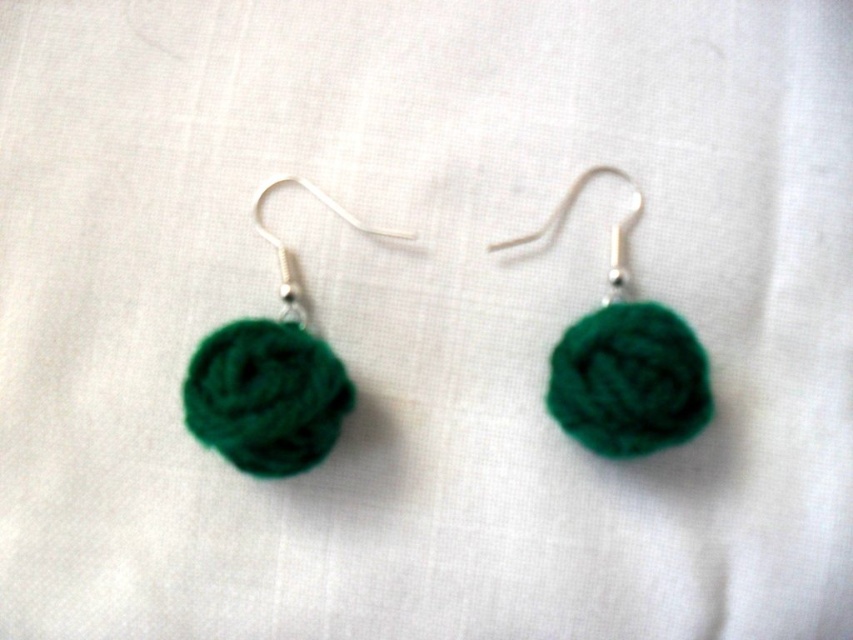
Question: Is emerald green felt ball at left above green fuzzy ball at center?

Choices:
 (A) no
 (B) yes

Answer: (A)

Question: Can you confirm if emerald green felt ball at left is thinner than green fuzzy ball at center?

Choices:
 (A) no
 (B) yes

Answer: (A)

Question: Does emerald green felt ball at left have a larger size compared to green fuzzy ball at center?

Choices:
 (A) no
 (B) yes

Answer: (B)

Question: Which of the following is the closest to the observer?

Choices:
 (A) (634, 209)
 (B) (294, 356)

Answer: (B)

Question: Which point is closer to the camera?

Choices:
 (A) (589, 442)
 (B) (241, 432)

Answer: (B)